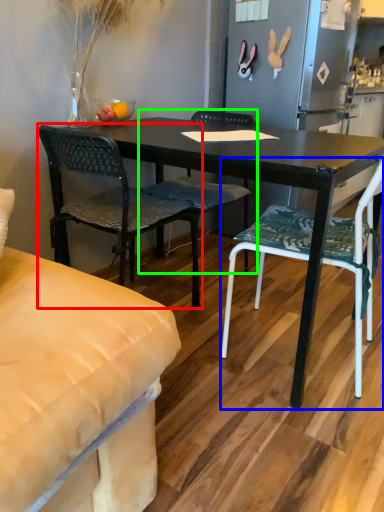
Question: Which object is positioned farthest from chair (highlighted by a red box)? Select from chair (highlighted by a blue box) and chair (highlighted by a green box).

Choices:
 (A) chair
 (B) chair

Answer: (A)